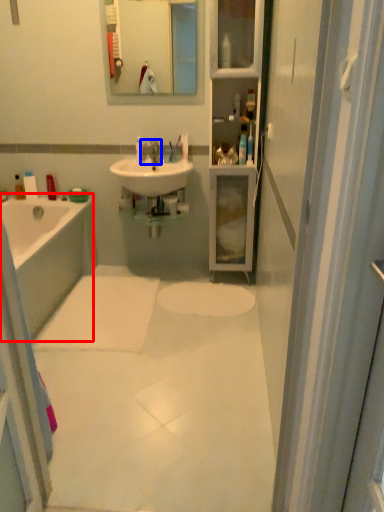
Question: Which point is further to the camera, bathtub (highlighted by a red box) or tap (highlighted by a blue box)?

Choices:
 (A) bathtub
 (B) tap

Answer: (B)